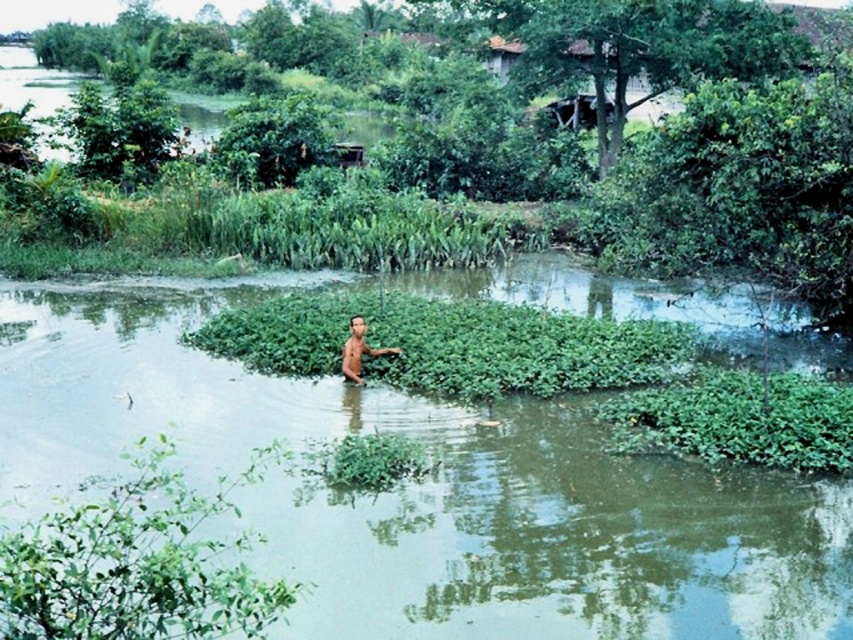
Question: Which object is farther from the camera taking this photo?

Choices:
 (A) green leafy plant at lower left
 (B) brown skin man at center

Answer: (B)

Question: Estimate the real-world distances between objects in this image. Which object is closer to the green leafy vegetation at center?

Choices:
 (A) green leafy plant at lower left
 (B) brown skin man at center

Answer: (B)

Question: Does green leafy vegetation at center appear over green leafy plant at lower left?

Choices:
 (A) yes
 (B) no

Answer: (A)

Question: Can you confirm if green leafy vegetation at center is smaller than green leafy plant at lower left?

Choices:
 (A) yes
 (B) no

Answer: (B)

Question: Among these points, which one is nearest to the camera?

Choices:
 (A) (540, 74)
 (B) (361, 340)

Answer: (B)

Question: Can you confirm if green leafy vegetation at center is positioned above brown skin man at center?

Choices:
 (A) yes
 (B) no

Answer: (A)